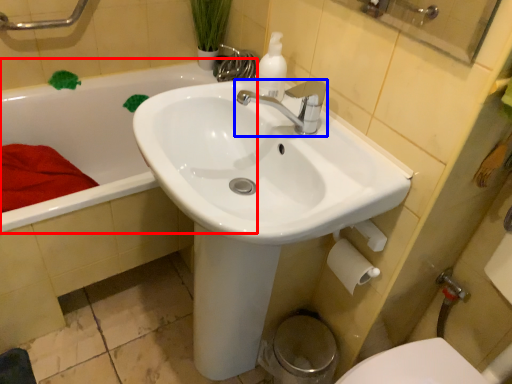
Question: Among these objects, which one is nearest to the camera, bathtub (highlighted by a red box) or tap (highlighted by a blue box)?

Choices:
 (A) bathtub
 (B) tap

Answer: (B)